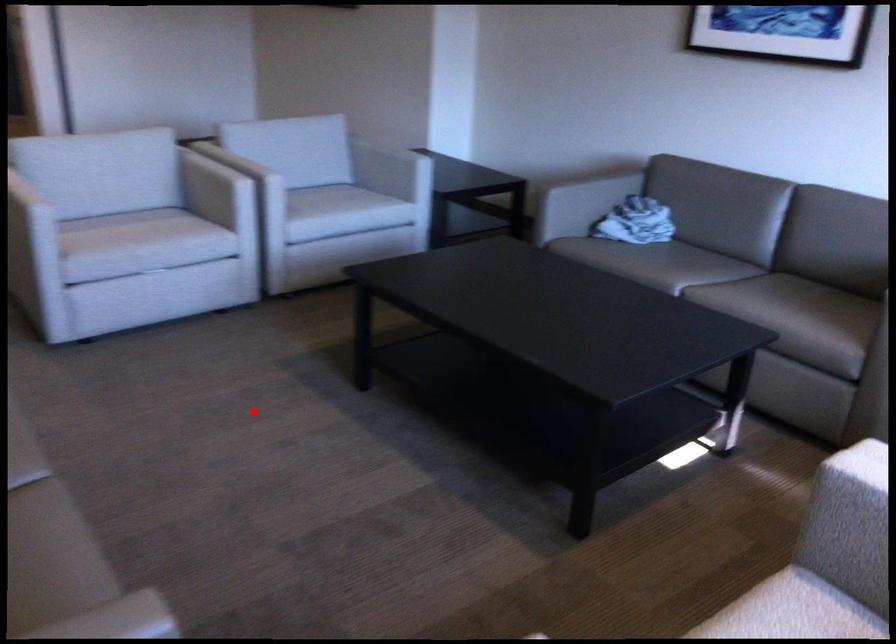
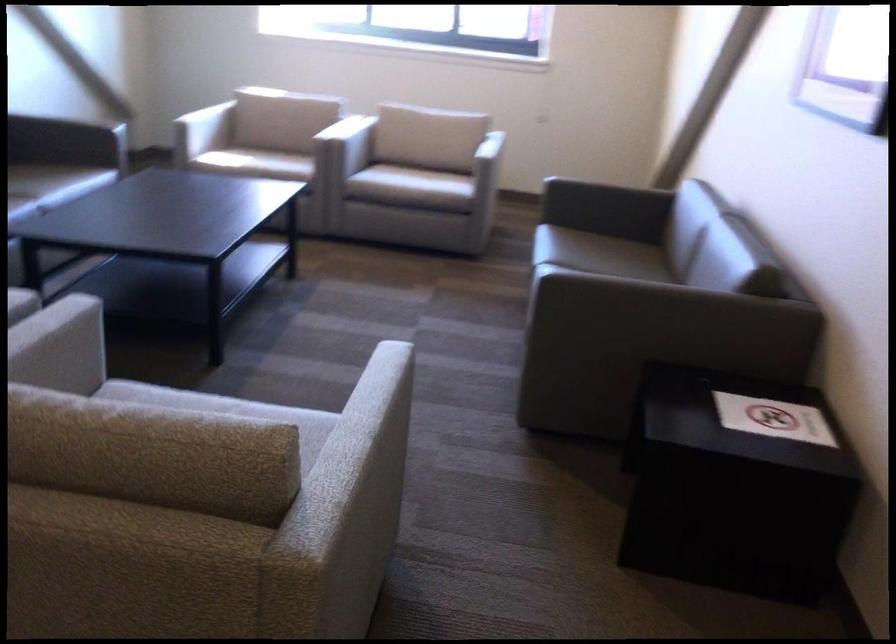
Find the pixel in the second image that matches the highlighted location in the first image.

(279, 406)